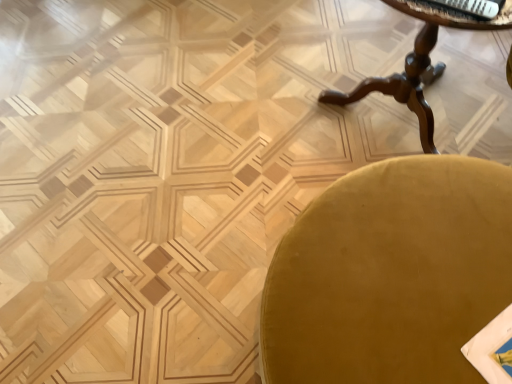
Find the location of a particular element. This screenshot has width=512, height=384. mahogany wood table at upper right is located at coordinates (418, 64).

This screenshot has height=384, width=512. What are the coordinates of `mahogany wood table at upper right` in the screenshot? It's located at (418, 64).

Could you tell me if mahogany wood table at upper right is facing velvet gold chair at lower right?

Yes, mahogany wood table at upper right is turned towards velvet gold chair at lower right.

Is point (432, 31) positioned behind point (324, 195)?

Yes.

Could you tell me if velvet gold chair at lower right is turned towards mahogany wood table at upper right?

No, velvet gold chair at lower right does not turn towards mahogany wood table at upper right.

Does velvet gold chair at lower right have a lesser width compared to mahogany wood table at upper right?

No.

From a real-world perspective, who is located higher, velvet gold chair at lower right or mahogany wood table at upper right?

In real-world perspective, mahogany wood table at upper right is above.

Is velvet gold chair at lower right taller than mahogany wood table at upper right?

In fact, velvet gold chair at lower right may be shorter than mahogany wood table at upper right.

How much distance is there between white glossy magazine at upper right and mahogany wood table at upper right?

white glossy magazine at upper right is 49.21 centimeters from mahogany wood table at upper right.

Is white glossy magazine at upper right to the right of mahogany wood table at upper right from the viewer's perspective?

In fact, white glossy magazine at upper right is to the left of mahogany wood table at upper right.

Considering the relative sizes of white glossy magazine at upper right and mahogany wood table at upper right in the image provided, is white glossy magazine at upper right smaller than mahogany wood table at upper right?

Yes, white glossy magazine at upper right is smaller than mahogany wood table at upper right.

From a real-world perspective, is white glossy magazine at upper right located higher than mahogany wood table at upper right?

Yes, from a real-world perspective, white glossy magazine at upper right is over mahogany wood table at upper right

How many degrees apart are the facing directions of mahogany wood table at upper right and white glossy magazine at upper right?

mahogany wood table at upper right and white glossy magazine at upper right are facing 14.6 degrees away from each other.

Is mahogany wood table at upper right aimed at white glossy magazine at upper right?

No, mahogany wood table at upper right is not turned towards white glossy magazine at upper right.

Considering the relative positions of mahogany wood table at upper right and white glossy magazine at upper right in the image provided, is mahogany wood table at upper right in front of white glossy magazine at upper right?

Yes, mahogany wood table at upper right is closer to the camera.

Which is more distant, (454,19) or (430,9)?

The point (430,9) is farther from the camera.

Between velvet gold chair at lower right and white glossy magazine at upper right, which one appears on the left side from the viewer's perspective?

velvet gold chair at lower right is more to the left.

What are the coordinates of `magazine lying behind the velvet gold chair at lower right` in the screenshot? It's located at (463, 8).

Is velvet gold chair at lower right facing towards white glossy magazine at upper right?

No, velvet gold chair at lower right is not oriented towards white glossy magazine at upper right.

Is velvet gold chair at lower right not near white glossy magazine at upper right?

No, velvet gold chair at lower right is not far away from white glossy magazine at upper right.

Are white glossy magazine at upper right and velvet gold chair at lower right far apart?

No, white glossy magazine at upper right is in close proximity to velvet gold chair at lower right.

Does white glossy magazine at upper right have a lesser height compared to velvet gold chair at lower right?

Yes, white glossy magazine at upper right is shorter than velvet gold chair at lower right.

Can you confirm if white glossy magazine at upper right is positioned to the right of velvet gold chair at lower right?

Indeed, white glossy magazine at upper right is positioned on the right side of velvet gold chair at lower right.

Is white glossy magazine at upper right smaller than velvet gold chair at lower right?

Yes.

The image size is (512, 384). I want to click on table above the velvet gold chair at lower right (from a real-world perspective), so click(418, 64).

At what (x,y) coordinates should I click in order to perform the action: click on table on the right of velvet gold chair at lower right. Please return your answer as a coordinate pair (x, y). The width and height of the screenshot is (512, 384). Looking at the image, I should click on (418, 64).

Based on the photo, considering their positions, is velvet gold chair at lower right positioned further to white glossy magazine at upper right than mahogany wood table at upper right?

Among the two, velvet gold chair at lower right is located further to white glossy magazine at upper right.

When comparing their distances from mahogany wood table at upper right, does velvet gold chair at lower right or white glossy magazine at upper right seem closer?

white glossy magazine at upper right.

Looking at the image, which one is located closer to mahogany wood table at upper right, white glossy magazine at upper right or velvet gold chair at lower right?

The object closer to mahogany wood table at upper right is white glossy magazine at upper right.

From the image, which object appears to be farther from velvet gold chair at lower right, white glossy magazine at upper right or mahogany wood table at upper right?

mahogany wood table at upper right is further to velvet gold chair at lower right.

Considering their positions, is mahogany wood table at upper right positioned closer to velvet gold chair at lower right than white glossy magazine at upper right?

white glossy magazine at upper right is closer to velvet gold chair at lower right.

Which object lies nearer to the anchor point white glossy magazine at upper right, mahogany wood table at upper right or velvet gold chair at lower right?

mahogany wood table at upper right lies closer to white glossy magazine at upper right than the other object.

At what (x,y) coordinates should I click in order to perform the action: click on magazine between mahogany wood table at upper right and velvet gold chair at lower right from top to bottom. Please return your answer as a coordinate pair (x, y). The image size is (512, 384). Looking at the image, I should click on (463, 8).